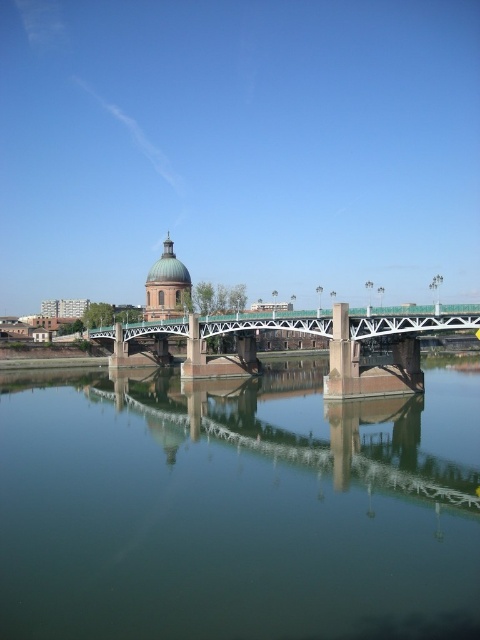
Question: Does green reflective water at center have a larger size compared to green metallic bridge at center?

Choices:
 (A) no
 (B) yes

Answer: (A)

Question: Is green reflective water at center below green metallic bridge at center?

Choices:
 (A) no
 (B) yes

Answer: (B)

Question: Which of the following is the farthest from the observer?

Choices:
 (A) (230, 440)
 (B) (223, 328)

Answer: (B)

Question: Does green reflective water at center lie in front of green metallic bridge at center?

Choices:
 (A) no
 (B) yes

Answer: (B)